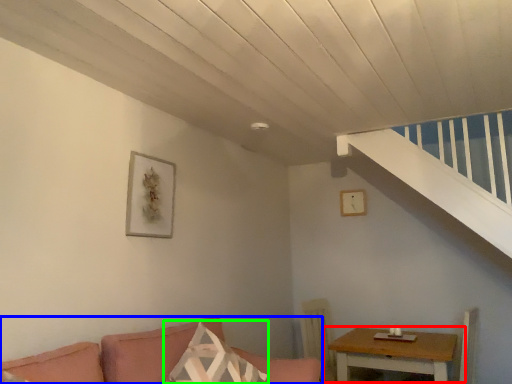
Question: Considering the real-world distances, which object is closest to table (highlighted by a red box)? studio couch (highlighted by a blue box) or pillow (highlighted by a green box).

Choices:
 (A) studio couch
 (B) pillow

Answer: (A)